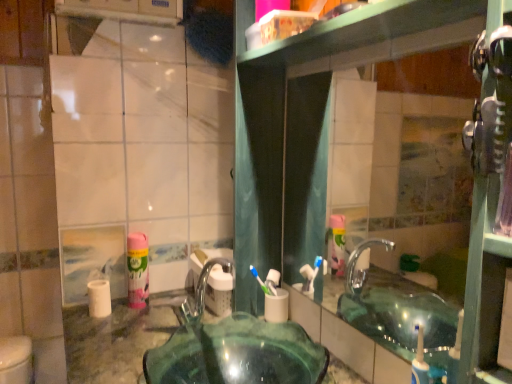
Locate an element on the screen. This screenshot has width=512, height=384. free space in front of pink matte mouthwash at left is located at coordinates (125, 326).